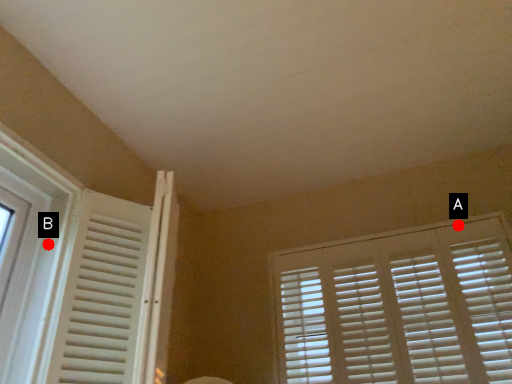
Question: Two points are circled on the image, labeled by A and B beside each circle. Which point is farther from the camera taking this photo?

Choices:
 (A) A is further
 (B) B is further

Answer: (A)